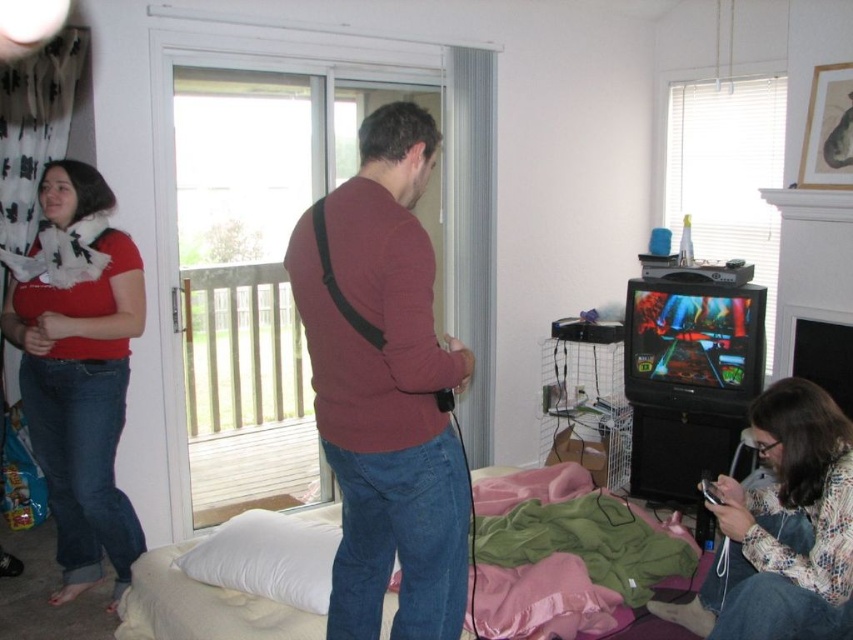
Is maroon sweater at center thinner than floral print sweater at lower right?

Result: Yes.

Is maroon sweater at center wider than floral print sweater at lower right?

No.

The height and width of the screenshot is (640, 853). Identify the location of maroon sweater at center. (386, 388).

Find the location of `maroon sweater at center`. maroon sweater at center is located at coordinates (386, 388).

Who is higher up, maroon sweater at center or matte red sweater at left?

Positioned higher is maroon sweater at center.

Is point (393, 339) positioned before point (94, 218)?

Yes, it is in front of point (94, 218).

Does point (450, 556) lie in front of point (86, 163)?

Yes, point (450, 556) is in front of point (86, 163).

Where is `maroon sweater at center`? maroon sweater at center is located at coordinates (386, 388).

Who is lower down, matte red sweater at left or floral print sweater at lower right?

floral print sweater at lower right

Who is positioned more to the left, matte red sweater at left or floral print sweater at lower right?

matte red sweater at left is more to the left.

Which is in front, point (109, 198) or point (694, 608)?

Point (694, 608) is in front.

This screenshot has height=640, width=853. Identify the location of matte red sweater at left. (78, 369).